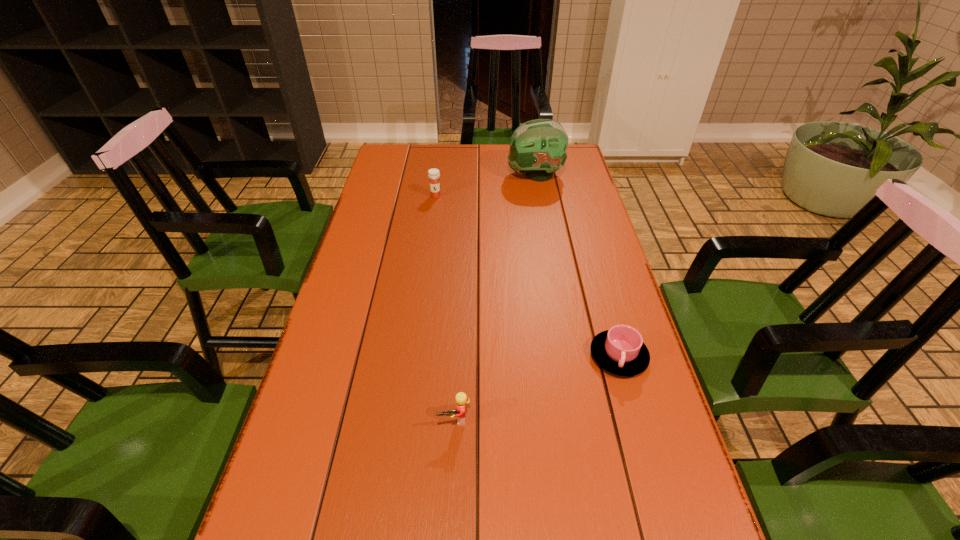
Locate an element on the screen. This screenshot has height=540, width=960. football helmet is located at coordinates (538, 147).

Image resolution: width=960 pixels, height=540 pixels. Find the location of `the tallest object`. the tallest object is located at coordinates (538, 147).

Locate an element on the screen. The image size is (960, 540). the leftmost object is located at coordinates (433, 174).

Locate an element on the screen. medicine is located at coordinates (433, 174).

In order to click on the third object from right to left in this screenshot , I will do `click(461, 399)`.

Locate an element on the screen. The height and width of the screenshot is (540, 960). the nearest object is located at coordinates (461, 399).

At what (x,y) coordinates should I click in order to perform the action: click on cup. Please return your answer as a coordinate pair (x, y). The image size is (960, 540). Looking at the image, I should click on (620, 350).

Identify the location of the shortest object. The width and height of the screenshot is (960, 540). (620, 350).

The height and width of the screenshot is (540, 960). What are the coordinates of `free space located on the visor of the farthest object` in the screenshot? It's located at (468, 175).

This screenshot has width=960, height=540. I want to click on free region located on the visor of the farthest object, so pyautogui.click(x=411, y=175).